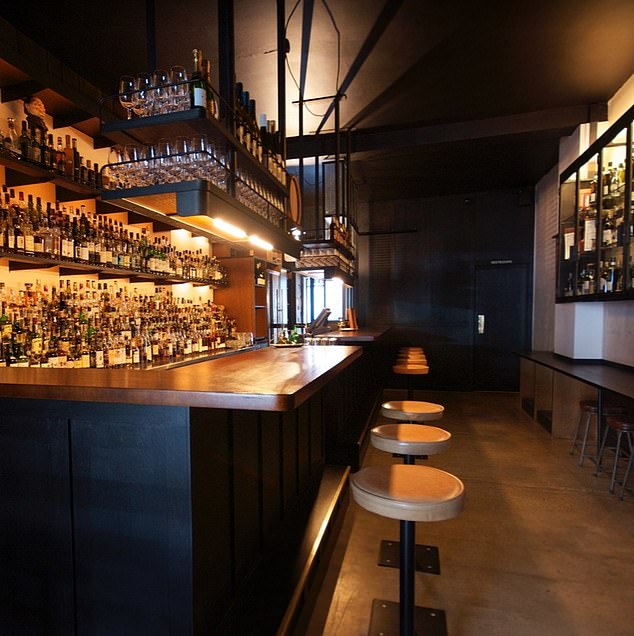
Where is `cabinets`? This screenshot has height=636, width=634. cabinets is located at coordinates (569, 238), (584, 238), (612, 235), (629, 235).